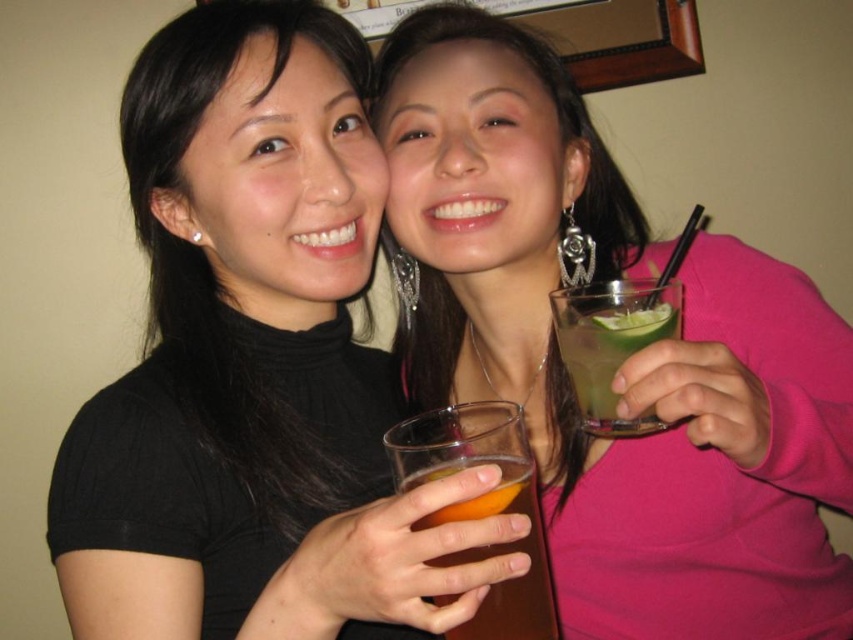
You are a photographer setting up for a group photo. You notice the matte black top at center and the green translucent glass at upper right. Which object is closer to the camera?

The matte black top at center is closer to the camera because it is positioned over the green translucent glass at upper right, meaning it is in front of it.

You are at a social event and want to take a photo of both people in the image. You notice two points marked on the image, point (345, 604) and point (540, 595). Which point should you focus on first to ensure both people are in the frame?

Point (345, 604) is in front of point (540, 595), so you should focus on point (345, 604) first to ensure both people are in the frame.

You are standing in front of the two people in the image and want to hand a gift to the person at point (x=624, y=563). If your arm can reach up to 30 inches, can you reach them without moving closer?

The distance between you and the person at point (x=624, y=563) is 34.24 inches, which is farther than your arm can reach. You need to move closer to reach them.